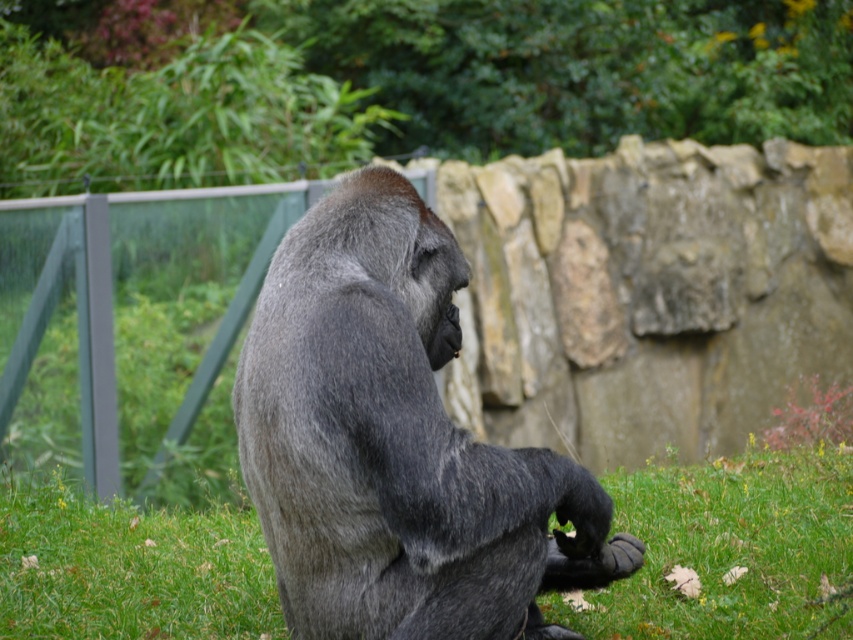
Question: Which object appears farthest from the camera in this image?

Choices:
 (A) gray fur gorilla at center
 (B) green soft grass at center

Answer: (B)

Question: Does gray fur gorilla at center have a greater width compared to green soft grass at center?

Choices:
 (A) yes
 (B) no

Answer: (B)

Question: Is gray fur gorilla at center thinner than green soft grass at center?

Choices:
 (A) no
 (B) yes

Answer: (B)

Question: From the image, what is the correct spatial relationship of gray fur gorilla at center in relation to green soft grass at center?

Choices:
 (A) right
 (B) left

Answer: (B)

Question: Which point is farther to the camera?

Choices:
 (A) green soft grass at center
 (B) gray fur gorilla at center

Answer: (A)